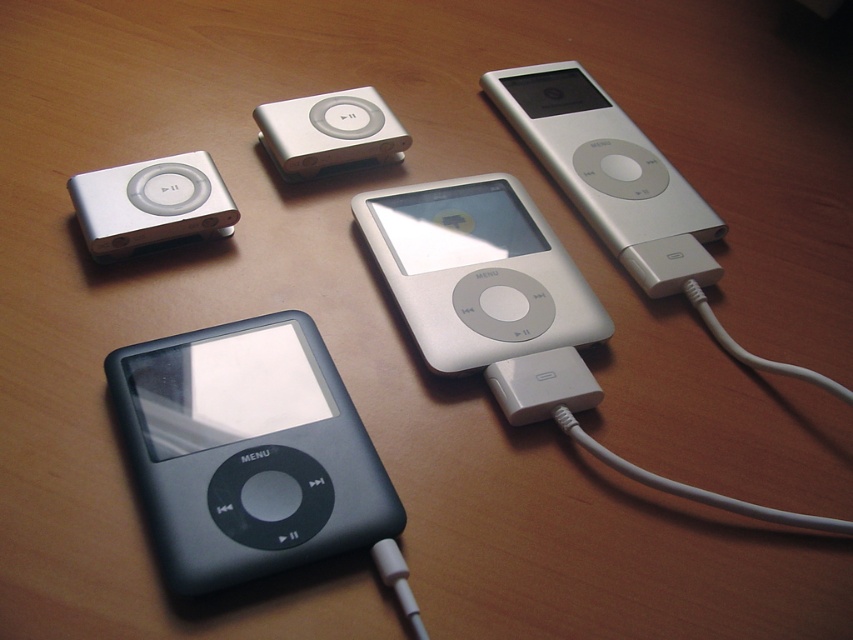
Does satin silver ipod at center appear under satin silver ipod at upper left?

Yes.

Does satin silver ipod at center have a smaller size compared to satin silver ipod at upper left?

Incorrect, satin silver ipod at center is not smaller in size than satin silver ipod at upper left.

Between point (436, 332) and point (107, 248), which one is positioned behind?

Positioned behind is point (107, 248).

Where is `satin silver ipod at center`? satin silver ipod at center is located at coordinates (477, 272).

Can you confirm if satin silver ipod at center is positioned to the right of sleek silver ipod at center-right?

In fact, satin silver ipod at center is to the left of sleek silver ipod at center-right.

Is satin silver ipod at center taller than sleek silver ipod at center-right?

No.

Which is in front, point (479, 330) or point (541, 141)?

Point (479, 330) is more forward.

Locate an element on the screen. satin silver ipod at center is located at coordinates (477, 272).

Which is behind, point (517, 218) or point (363, 122)?

Positioned behind is point (363, 122).

Measure the distance from satin silver ipod at center to silver/metallic ipod at upper center.

satin silver ipod at center and silver/metallic ipod at upper center are 22.10 centimeters apart from each other.

Describe the element at coordinates (477, 272) in the screenshot. I see `satin silver ipod at center` at that location.

You are a GUI agent. You are given a task and a screenshot of the screen. Output one action in this format:
    pyautogui.click(x=<x>, y=<y>)
    Task: Click on the satin silver ipod at center
    The height and width of the screenshot is (640, 853).
    Given the screenshot: What is the action you would take?
    pyautogui.click(x=477, y=272)